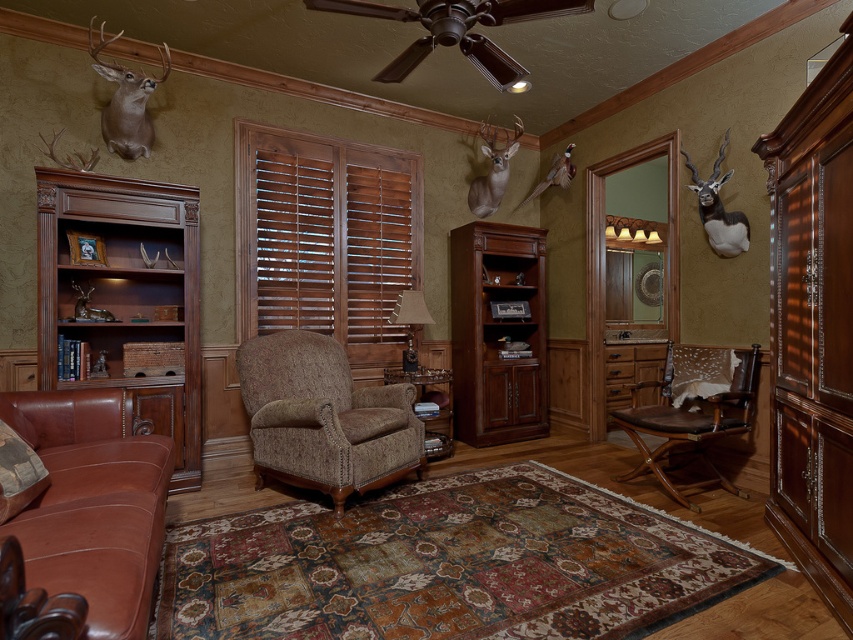
Find the location of `wooden shutters at center`. wooden shutters at center is located at coordinates (326, 240).

Between point (392, 243) and point (181, 232), which one is positioned in front?

Point (181, 232)

I want to click on wooden shutters at center, so click(326, 240).

Does wooden shutters at center have a smaller size compared to brown leather armchair at lower right?

No.

Which is behind, point (378, 292) or point (633, 477)?

The point (378, 292) is more distant.

Where is `wooden shutters at center`? The width and height of the screenshot is (853, 640). wooden shutters at center is located at coordinates (326, 240).

Can you confirm if textured brown armchair at center is positioned below brown leather armchair at lower right?

No.

Does textured brown armchair at center have a larger size compared to brown leather armchair at lower right?

Correct, textured brown armchair at center is larger in size than brown leather armchair at lower right.

Which is behind, point (335, 508) or point (697, 451)?

The point (697, 451) is behind.

Find the location of `textured brown armchair at center`. textured brown armchair at center is located at coordinates (323, 417).